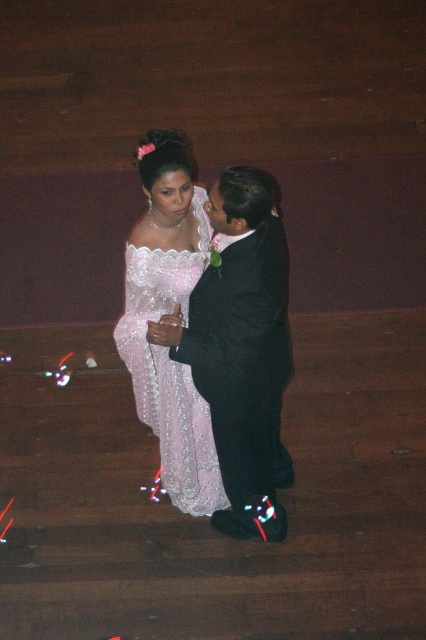
Question: Which point is closer to the camera?

Choices:
 (A) shiny black suit at center
 (B) matte lace dress at center

Answer: (A)

Question: Considering the relative positions of shiny black suit at center and matte lace dress at center in the image provided, where is shiny black suit at center located with respect to matte lace dress at center?

Choices:
 (A) above
 (B) below

Answer: (B)

Question: Observing the image, what is the correct spatial positioning of shiny black suit at center in reference to matte lace dress at center?

Choices:
 (A) below
 (B) above

Answer: (A)

Question: Where is shiny black suit at center located in relation to matte lace dress at center in the image?

Choices:
 (A) right
 (B) left

Answer: (A)

Question: Which of the following is the farthest from the observer?

Choices:
 (A) matte lace dress at center
 (B) shiny black suit at center

Answer: (A)